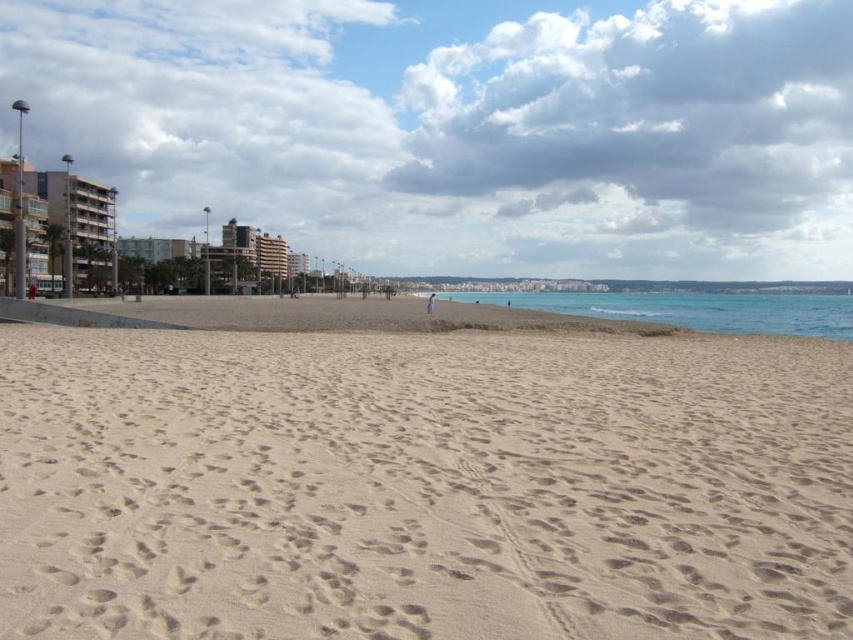
Question: Which of the following is the closest to the observer?

Choices:
 (A) light beige sand at center
 (B) blue water at lower right
 (C) green glass building at left

Answer: (A)

Question: Is blue water at lower right in front of green glass building at left?

Choices:
 (A) yes
 (B) no

Answer: (A)

Question: Does blue water at lower right have a larger size compared to green glass building at left?

Choices:
 (A) no
 (B) yes

Answer: (B)

Question: Which object is farther from the camera taking this photo?

Choices:
 (A) green glass building at left
 (B) light beige sand at center
 (C) blue water at lower right

Answer: (A)

Question: Which point appears farthest from the camera in this image?

Choices:
 (A) (833, 362)
 (B) (809, 317)
 (C) (28, 248)

Answer: (C)

Question: Is light beige sand at center to the left of blue water at lower right from the viewer's perspective?

Choices:
 (A) yes
 (B) no

Answer: (A)